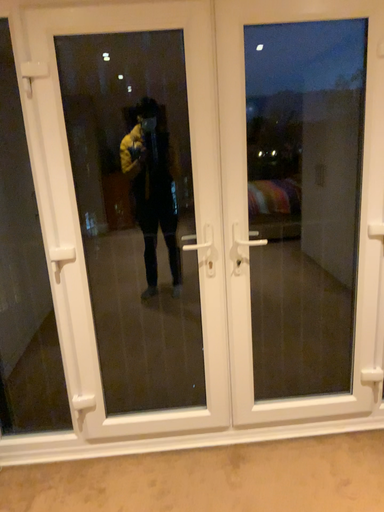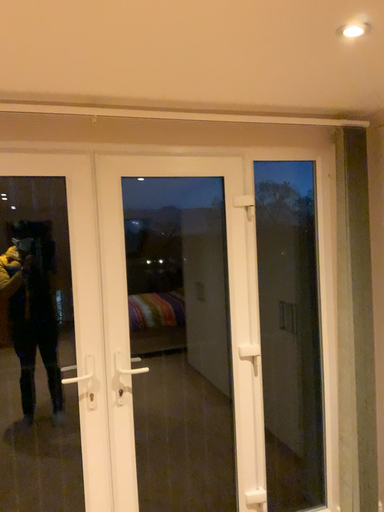
Question: How did the camera likely rotate when shooting the video?

Choices:
 (A) rotated downward
 (B) rotated upward

Answer: (B)